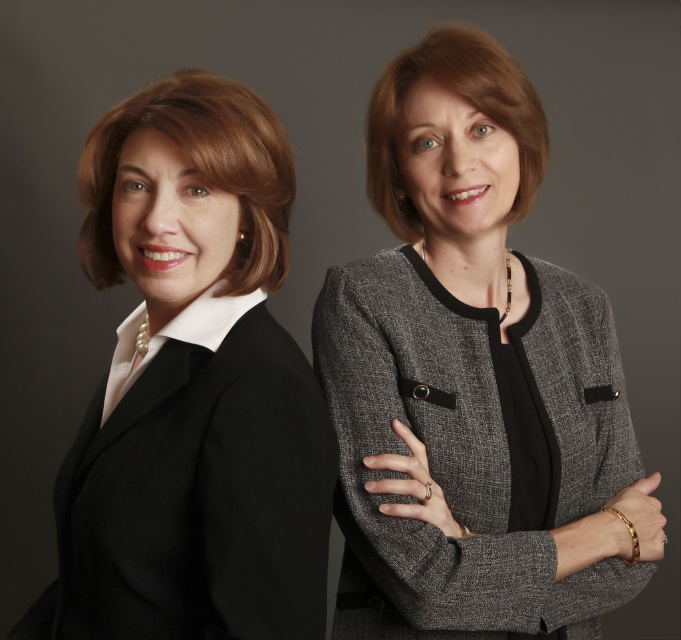
You are a fashion designer assessing blazers for a client. You have two options in front of you, the black matte blazer at left and the gray textured blazer at center. Which blazer would you recommend if the client prefers a more oversized style?

The black matte blazer at left has a larger size compared to the gray textured blazer at center, so it would be the better choice for an oversized style.